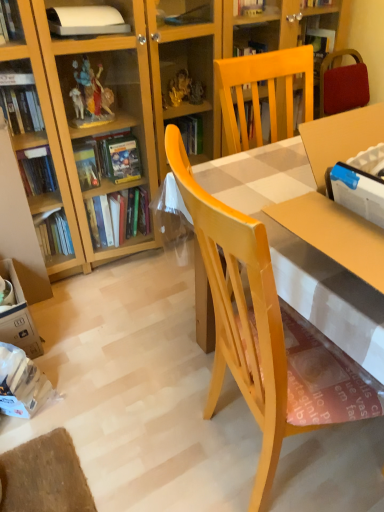
Question: Should I look upward or downward to see yellow wood chair at center?

Choices:
 (A) up
 (B) down

Answer: (B)